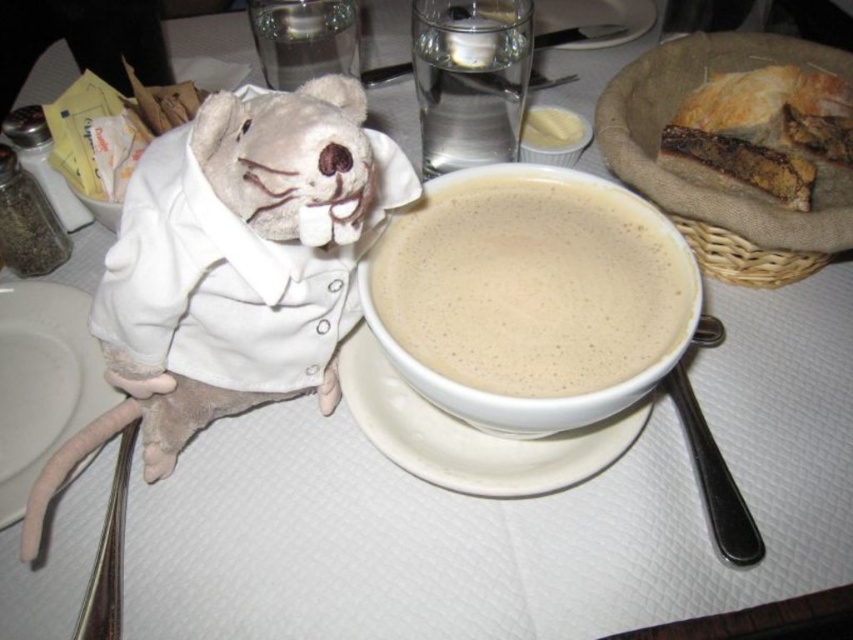
You are a guest at this dining table. You want to pass the white ceramic saucer at center to the person sitting to your left. Is the fuzzy plush toy at upper left in the way of passing the saucer?

The fuzzy plush toy at upper left is to the left of the white ceramic saucer at center, so it is positioned in the direction you want to pass the saucer. This means the toy might be in the way of passing the saucer to the left.

You are a guest at this dining table and want to reach for the white matte soup at center. Based on the coordinates provided, can you estimate its position relative to the edge of the table?

The white matte soup at center is located at coordinates approximately 62.3 cm from the left edge and 63.1 cm from the bottom edge of the table, assuming the coordinate system starts at the bottom left corner. This places it centrally on the table.